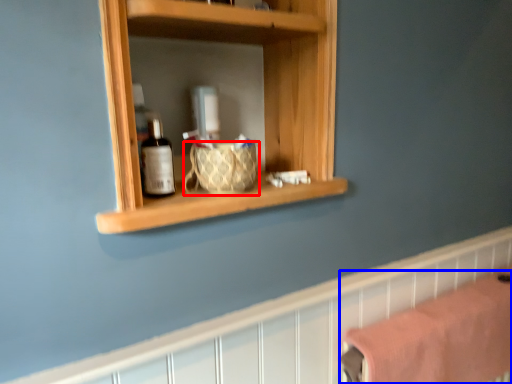
Question: Which of the following is the closest to the observer, basket (highlighted by a red box) or bath towel (highlighted by a blue box)?

Choices:
 (A) basket
 (B) bath towel

Answer: (A)